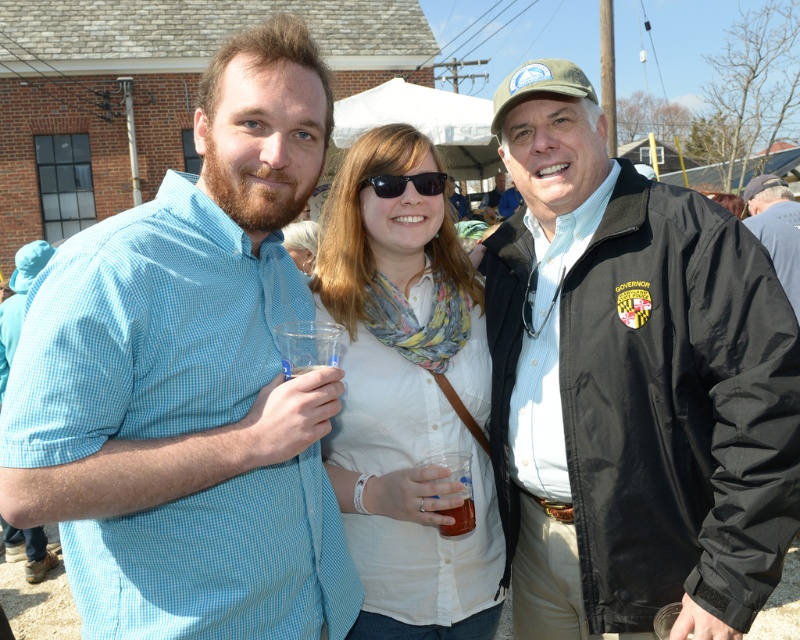
You are a photographer at the event and need to ensure that both the black nylon jacket at center and the translucent plastic cup at center are visible in your photo. Based on their sizes, which object will occupy more space in the frame?

The black nylon jacket at center has a greater width than the translucent plastic cup at center, so it will occupy more space in the frame.

You are taking a photo of the scene and want to focus on both the point at (x=530, y=408) and the point at (x=362, y=180). Which point should you adjust your focus to first to ensure both are in sharp focus?

Since point (x=530, y=408) is closer to the camera than point (x=362, y=180), you should focus on the closer point first to ensure both are within the depth of field.

You are standing at the origin point of the coordinate system in the image. Which object is located at the coordinates point [632,385]?

The point [632,385] corresponds to the black nylon jacket at center.